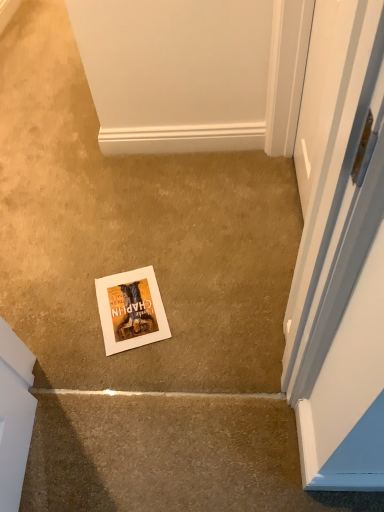
Where is `free location above matte paper postcard at center (from a real-world perspective)`? This screenshot has height=512, width=384. free location above matte paper postcard at center (from a real-world perspective) is located at coordinates (123, 303).